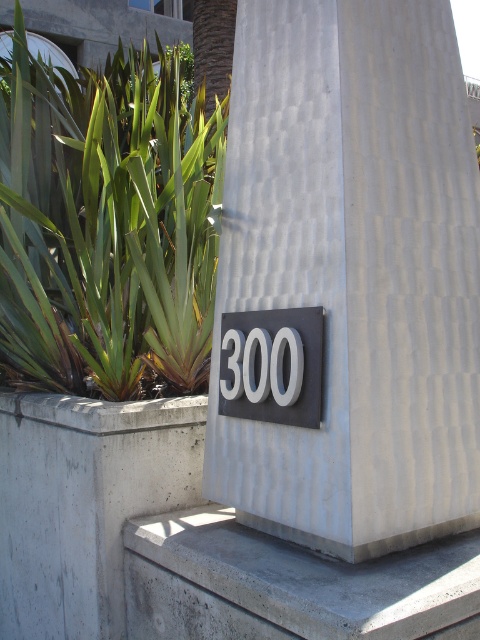
Question: In this image, where is concrete at center located relative to green leafy plant at left?

Choices:
 (A) right
 (B) left

Answer: (A)

Question: Which of the following is the farthest from the observer?

Choices:
 (A) matte black sign at center
 (B) gray concrete ledge at lower center
 (C) concrete at center

Answer: (A)

Question: Considering the real-world distances, which object is farthest from the matte black sign at center?

Choices:
 (A) green leafy plant at left
 (B) gray concrete ledge at lower center

Answer: (A)

Question: Does concrete at center appear on the right side of gray concrete ledge at lower center?

Choices:
 (A) no
 (B) yes

Answer: (A)

Question: Considering the real-world distances, which object is closest to the gray concrete ledge at lower center?

Choices:
 (A) matte black sign at center
 (B) green leafy plant at left

Answer: (A)

Question: Is gray concrete ledge at lower center above matte black sign at center?

Choices:
 (A) yes
 (B) no

Answer: (B)